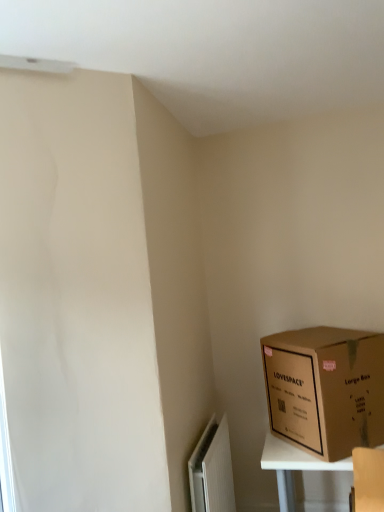
Question: Is white matte radiator at lower left thinner than brown cardboard box at lower right?

Choices:
 (A) yes
 (B) no

Answer: (A)

Question: Is white matte radiator at lower left at the right side of brown cardboard box at lower right?

Choices:
 (A) no
 (B) yes

Answer: (A)

Question: From the image's perspective, is white matte radiator at lower left on brown cardboard box at lower right?

Choices:
 (A) yes
 (B) no

Answer: (B)

Question: Does white matte radiator at lower left come behind brown cardboard box at lower right?

Choices:
 (A) yes
 (B) no

Answer: (B)

Question: Is white matte radiator at lower left positioned beyond the bounds of brown cardboard box at lower right?

Choices:
 (A) no
 (B) yes

Answer: (B)

Question: Is white matte radiator at lower left facing towards brown cardboard box at lower right?

Choices:
 (A) no
 (B) yes

Answer: (B)

Question: Is brown cardboard box at lower right facing towards white matte radiator at lower left?

Choices:
 (A) no
 (B) yes

Answer: (A)

Question: From a real-world perspective, is brown cardboard box at lower right under white matte radiator at lower left?

Choices:
 (A) yes
 (B) no

Answer: (B)

Question: Can you confirm if brown cardboard box at lower right is smaller than white matte radiator at lower left?

Choices:
 (A) no
 (B) yes

Answer: (A)

Question: Is white matte radiator at lower left inside brown cardboard box at lower right?

Choices:
 (A) no
 (B) yes

Answer: (A)

Question: Is the depth of brown cardboard box at lower right less than that of white matte radiator at lower left?

Choices:
 (A) yes
 (B) no

Answer: (B)

Question: Would you consider brown cardboard box at lower right to be distant from white matte radiator at lower left?

Choices:
 (A) yes
 (B) no

Answer: (B)

Question: From their relative heights in the image, would you say white matte radiator at lower left is taller or shorter than brown cardboard box at lower right?

Choices:
 (A) tall
 (B) short

Answer: (A)